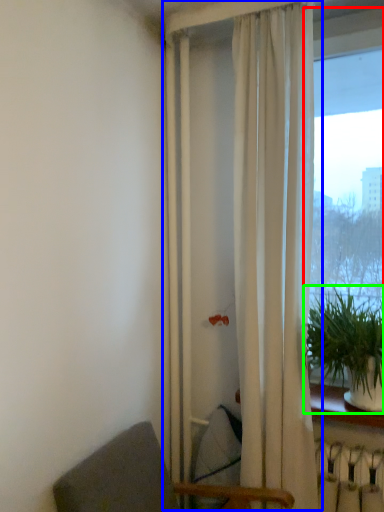
Question: Considering the real-world distances, which object is farthest from window (highlighted by a red box)? curtain (highlighted by a blue box) or houseplant (highlighted by a green box)?

Choices:
 (A) curtain
 (B) houseplant

Answer: (B)